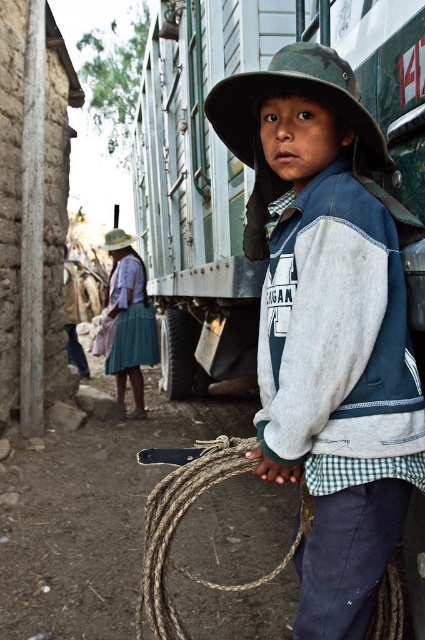
Is camo fabric hat at center to the right of white matte hat at upper center from the viewer's perspective?

Correct, you'll find camo fabric hat at center to the right of white matte hat at upper center.

This screenshot has width=425, height=640. Describe the element at coordinates (294, 93) in the screenshot. I see `camo fabric hat at center` at that location.

Where is `camo fabric hat at center`? The image size is (425, 640). camo fabric hat at center is located at coordinates (294, 93).

Between green painted metal train car at center and camo fabric hat at center, which one has more height?

green painted metal train car at center

Find the location of a particular element. green painted metal train car at center is located at coordinates (198, 186).

Does denim jacket at center appear over green painted metal train car at center?

No.

Which is more to the left, denim jacket at center or green painted metal train car at center?

From the viewer's perspective, green painted metal train car at center appears more on the left side.

At what (x,y) coordinates should I click in order to perform the action: click on denim jacket at center. Please return your answer as a coordinate pair (x, y). This screenshot has width=425, height=640. Looking at the image, I should click on coord(328,323).

At what (x,y) coordinates should I click in order to perform the action: click on denim jacket at center. Please return your answer as a coordinate pair (x, y). Looking at the image, I should click on (328, 323).